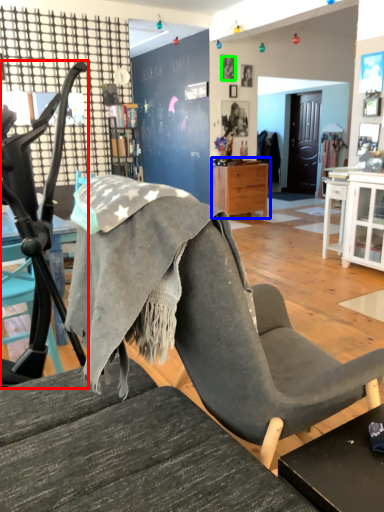
Question: Considering the real-world distances, which object is closest to chair (highlighted by a red box)? nightstand (highlighted by a blue box) or person (highlighted by a green box).

Choices:
 (A) nightstand
 (B) person

Answer: (A)